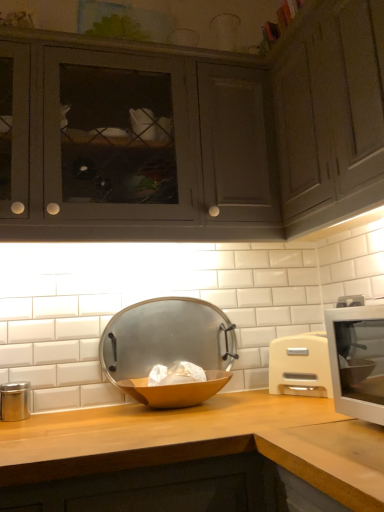
Question: Is matte gray cabinets at upper left, the 2th cabinetry viewed from the right, positioned with its back to wooden bowl at center?

Choices:
 (A) no
 (B) yes

Answer: (A)

Question: Is matte gray cabinets at upper left, the 2th cabinetry viewed from the right, positioned far away from wooden bowl at center?

Choices:
 (A) no
 (B) yes

Answer: (A)

Question: Is matte gray cabinets at upper left, the 2th cabinetry viewed from the right, positioned before wooden bowl at center?

Choices:
 (A) no
 (B) yes

Answer: (B)

Question: From a real-world perspective, is matte gray cabinets at upper left, which ranks as the 1th cabinetry in left-to-right order, positioned over wooden bowl at center based on gravity?

Choices:
 (A) no
 (B) yes

Answer: (B)

Question: Is matte gray cabinets at upper left, the 2th cabinetry viewed from the right, thinner than wooden bowl at center?

Choices:
 (A) yes
 (B) no

Answer: (B)

Question: From the image's perspective, is wooden bowl at center located above or below metallic silver bowl at center?

Choices:
 (A) below
 (B) above

Answer: (A)

Question: Considering the positions of wooden bowl at center and metallic silver bowl at center in the image, is wooden bowl at center taller or shorter than metallic silver bowl at center?

Choices:
 (A) short
 (B) tall

Answer: (A)

Question: In terms of size, does wooden bowl at center appear bigger or smaller than metallic silver bowl at center?

Choices:
 (A) big
 (B) small

Answer: (B)

Question: From a real-world perspective, is wooden bowl at center physically located above or below metallic silver bowl at center?

Choices:
 (A) above
 (B) below

Answer: (B)

Question: From a real-world perspective, is wooden at center physically located above or below white plastic microwave at right?

Choices:
 (A) above
 (B) below

Answer: (B)

Question: Is wooden at center bigger or smaller than white plastic microwave at right?

Choices:
 (A) big
 (B) small

Answer: (A)

Question: Considering the relative positions of wooden at center and white plastic microwave at right in the image provided, is wooden at center to the left or to the right of white plastic microwave at right?

Choices:
 (A) left
 (B) right

Answer: (A)

Question: Does point (221, 429) appear closer or farther from the camera than point (319, 379)?

Choices:
 (A) farther
 (B) closer

Answer: (B)

Question: Is metallic silver bowl at center in front of or behind white plastic microwave at right in the image?

Choices:
 (A) front
 (B) behind

Answer: (B)

Question: Looking at their shapes, would you say metallic silver bowl at center is wider or thinner than white plastic microwave at right?

Choices:
 (A) wide
 (B) thin

Answer: (B)